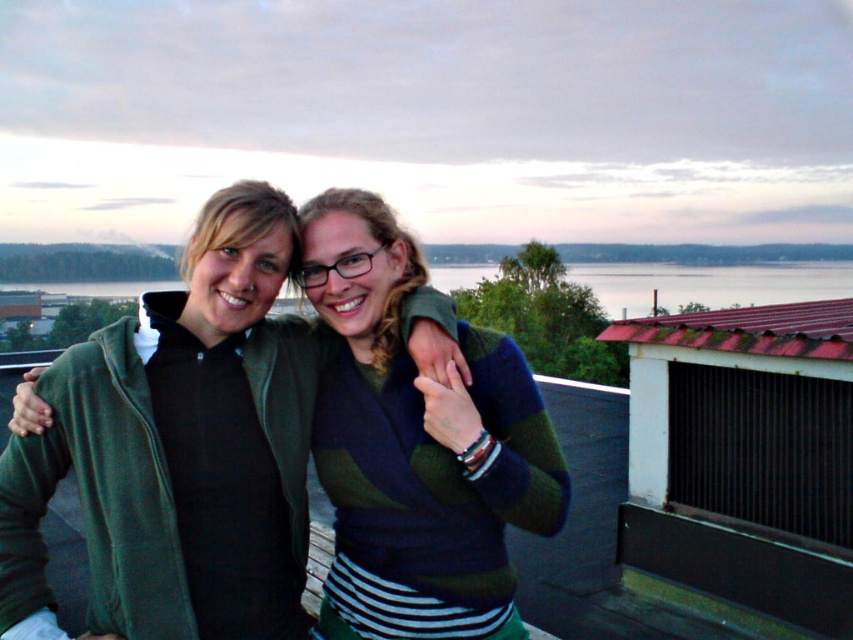
You are trying to decide which clothing item to take with you for a chilly evening. Both the green fleece jacket at center and the striped sweater at center are available. Based on their sizes, which one would be more suitable for keeping warm?

The green fleece jacket at center is bigger than the striped sweater at center, so it would provide more warmth and coverage, making it more suitable for a chilly evening.

You are a fashion designer observing two people on a deck wearing a green fleece jacket at center and a striped sweater at center. Which clothing item is covering the other?

The green fleece jacket at center is positioned over striped sweater at center, so the green fleece jacket is covering the striped sweater.